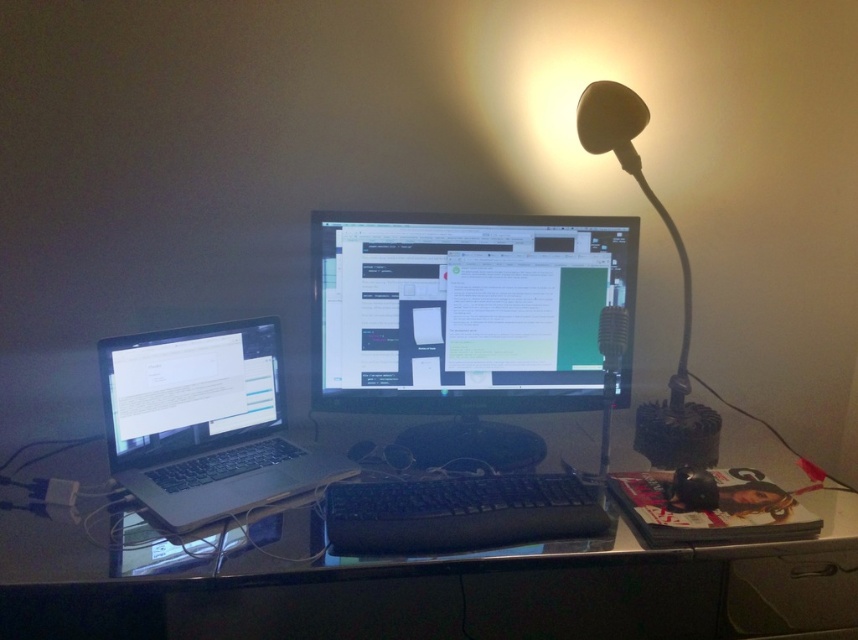
Question: Is black plastic table at center above satin black laptop at left?

Choices:
 (A) no
 (B) yes

Answer: (A)

Question: Which of the following is the closest to the observer?

Choices:
 (A) silver metallic laptop at left
 (B) black plastic keyboard at center

Answer: (B)

Question: Which object is the closest to the black plastic table at center?

Choices:
 (A) matte black lamp at upper right
 (B) silver metallic laptop at left

Answer: (B)

Question: Is satin black laptop at left to the right of matte black lamp at upper right from the viewer's perspective?

Choices:
 (A) no
 (B) yes

Answer: (A)

Question: Which object is closer to the camera taking this photo?

Choices:
 (A) black plastic table at center
 (B) black plastic keyboard at center

Answer: (A)

Question: Where is black glossy monitor at center located in relation to matte black lamp at upper right in the image?

Choices:
 (A) above
 (B) below

Answer: (B)